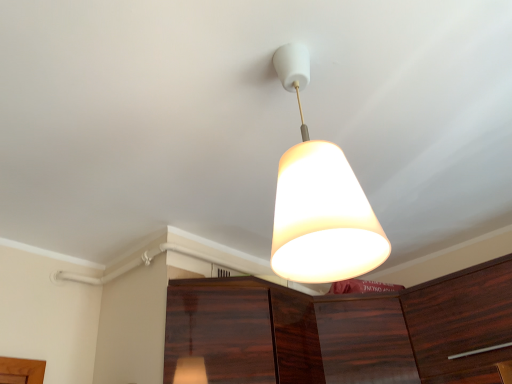
At what (x,y) coordinates should I click in order to perform the action: click on matte white lampshade at center. Please return your answer as a coordinate pair (x, y). This screenshot has height=384, width=512. Looking at the image, I should click on (320, 202).

What do you see at coordinates (320, 202) in the screenshot? The image size is (512, 384). I see `matte white lampshade at center` at bounding box center [320, 202].

Where is `matte white lampshade at center`? The height and width of the screenshot is (384, 512). matte white lampshade at center is located at coordinates (320, 202).